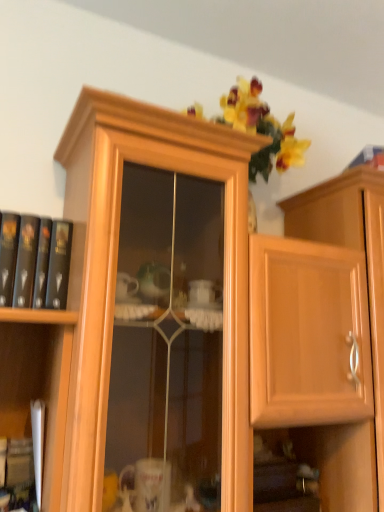
I want to click on white matte book at left, so click(38, 444).

The height and width of the screenshot is (512, 384). Describe the element at coordinates (38, 444) in the screenshot. I see `white matte book at left` at that location.

Identify the location of white matte book at left. The height and width of the screenshot is (512, 384). (38, 444).